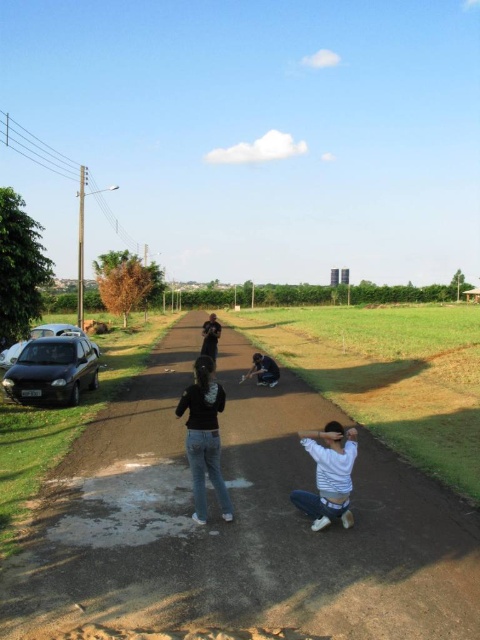
Question: Considering the relative positions of white matte shirt at lower right and shiny metallic car at lower left in the image provided, where is white matte shirt at lower right located with respect to shiny metallic car at lower left?

Choices:
 (A) below
 (B) above

Answer: (A)

Question: Is denim jeans at center positioned at the back of white matte shirt at lower right?

Choices:
 (A) no
 (B) yes

Answer: (B)

Question: Which of the following is the closest to the observer?

Choices:
 (A) shiny metallic car at lower left
 (B) black matte man at center

Answer: (B)

Question: Which point appears farthest from the camera in this image?

Choices:
 (A) (215, 317)
 (B) (324, 451)
 (C) (425, 497)

Answer: (A)

Question: From the image, what is the correct spatial relationship of denim jeans at center in relation to white matte shirt at lower right?

Choices:
 (A) left
 (B) right

Answer: (A)

Question: Which point is farther to the camera?

Choices:
 (A) (72, 388)
 (B) (11, 358)
 (C) (327, 481)

Answer: (B)